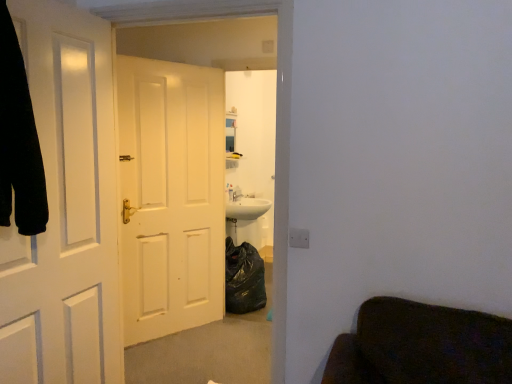
Question: From a real-world perspective, is white matte door at left, arranged as the 2th door when viewed from the back, above or below black fabric robe at left?

Choices:
 (A) below
 (B) above

Answer: (A)

Question: Is point (84, 332) closer or farther from the camera than point (27, 165)?

Choices:
 (A) farther
 (B) closer

Answer: (A)

Question: Which is farther from the white matte door at left, the 1th door positioned from the front?

Choices:
 (A) white matte door at center, which is the 2th door in front-to-back order
 (B) black fabric robe at left

Answer: (A)

Question: Which is farther from the white matte door at center, positioned as the 1th door in back-to-front order?

Choices:
 (A) black fabric robe at left
 (B) white matte door at left, the 1th door positioned from the front

Answer: (A)